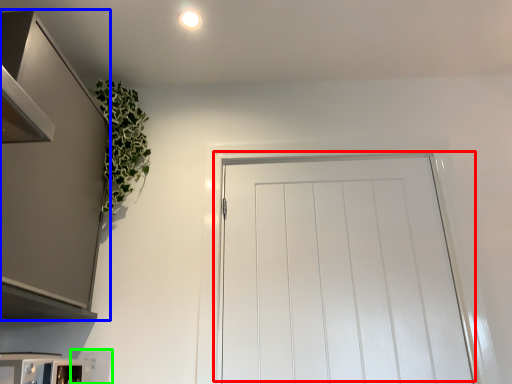
Question: Which object is the farthest from door (highlighted by a red box)? Choose among these: cabinetry (highlighted by a blue box) or appliance (highlighted by a green box).

Choices:
 (A) cabinetry
 (B) appliance

Answer: (B)